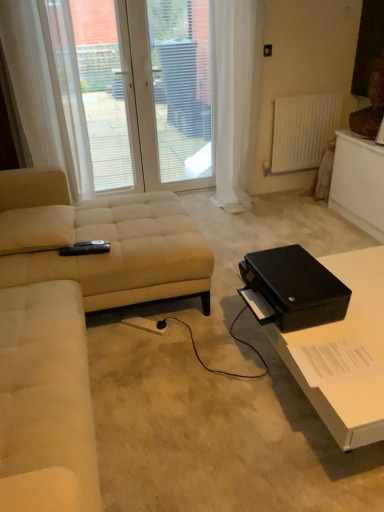
Question: Is beige fabric studio couch at left a part of white sheer curtain at upper center?

Choices:
 (A) no
 (B) yes

Answer: (A)

Question: Is white sheer curtain at upper center to the left of beige fabric studio couch at left from the viewer's perspective?

Choices:
 (A) no
 (B) yes

Answer: (B)

Question: Are white sheer curtain at upper center and beige fabric studio couch at left far apart?

Choices:
 (A) no
 (B) yes

Answer: (B)

Question: From the image's perspective, would you say white sheer curtain at upper center is positioned over beige fabric studio couch at left?

Choices:
 (A) no
 (B) yes

Answer: (B)

Question: From the image's perspective, is white sheer curtain at upper center beneath beige fabric studio couch at left?

Choices:
 (A) no
 (B) yes

Answer: (A)

Question: Is white sheer curtain at upper center smaller than beige fabric studio couch at left?

Choices:
 (A) no
 (B) yes

Answer: (B)

Question: From the image's perspective, is black matte box at right under beige fabric couch at left?

Choices:
 (A) yes
 (B) no

Answer: (B)

Question: Is black matte box at right facing towards beige fabric couch at left?

Choices:
 (A) yes
 (B) no

Answer: (A)

Question: Is black matte box at right not near beige fabric couch at left?

Choices:
 (A) yes
 (B) no

Answer: (B)

Question: Is black matte box at right positioned beyond the bounds of beige fabric couch at left?

Choices:
 (A) yes
 (B) no

Answer: (A)

Question: Is black matte box at right wider than beige fabric couch at left?

Choices:
 (A) no
 (B) yes

Answer: (A)

Question: From a real-world perspective, is black matte box at right located higher than beige fabric couch at left?

Choices:
 (A) no
 (B) yes

Answer: (A)

Question: Is white fabric curtain at right, positioned as the second curtain in left-to-right order, taller than white matte radiator at upper right?

Choices:
 (A) no
 (B) yes

Answer: (B)